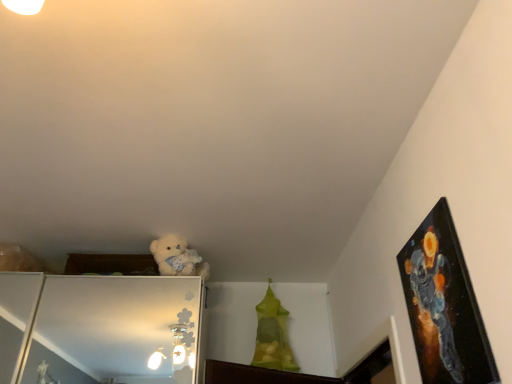
Describe the element at coordinates (444, 305) in the screenshot. Image resolution: width=512 pixels, height=384 pixels. I see `black glossy picture frame at upper right` at that location.

At what (x,y) coordinates should I click in order to perform the action: click on black glossy picture frame at upper right. Please return your answer as a coordinate pair (x, y). The width and height of the screenshot is (512, 384). Looking at the image, I should click on (444, 305).

In order to face black glossy picture frame at upper right, should I rotate leftwards or rightwards?

To face it directly, rotate right by 22.471 degrees.

What do you see at coordinates (178, 258) in the screenshot? This screenshot has height=384, width=512. I see `fluffy white teddy bear at upper center` at bounding box center [178, 258].

You are a GUI agent. You are given a task and a screenshot of the screen. Output one action in this format:
    pyautogui.click(x=<x>, y=<y>)
    Task: Click on the fluffy white teddy bear at upper center
    This screenshot has height=384, width=512.
    Given the screenshot: What is the action you would take?
    pyautogui.click(x=178, y=258)

The image size is (512, 384). In order to click on black glossy picture frame at upper right in this screenshot , I will do (444, 305).

Considering the relative positions of black glossy picture frame at upper right and fluffy white teddy bear at upper center in the image provided, is black glossy picture frame at upper right to the left of fluffy white teddy bear at upper center from the viewer's perspective?

Incorrect, black glossy picture frame at upper right is not on the left side of fluffy white teddy bear at upper center.

Which is behind, black glossy picture frame at upper right or fluffy white teddy bear at upper center?

fluffy white teddy bear at upper center is further away from the camera.

Considering the positions of points (426, 301) and (170, 249), is point (426, 301) closer to camera compared to point (170, 249)?

Yes, it is.

From the image's perspective, does black glossy picture frame at upper right appear higher than fluffy white teddy bear at upper center?

Yes, from the image's perspective, black glossy picture frame at upper right is on top of fluffy white teddy bear at upper center.

From a real-world perspective, which is physically above, black glossy picture frame at upper right or fluffy white teddy bear at upper center?

In real-world perspective, fluffy white teddy bear at upper center is above.

Can you confirm if black glossy picture frame at upper right is thinner than fluffy white teddy bear at upper center?

Correct, the width of black glossy picture frame at upper right is less than that of fluffy white teddy bear at upper center.

Does black glossy picture frame at upper right have a greater height compared to fluffy white teddy bear at upper center?

Yes, black glossy picture frame at upper right is taller than fluffy white teddy bear at upper center.

Based on the photo, considering the sizes of objects black glossy picture frame at upper right and fluffy white teddy bear at upper center in the image provided, who is smaller, black glossy picture frame at upper right or fluffy white teddy bear at upper center?

black glossy picture frame at upper right is smaller.

Is black glossy picture frame at upper right not within fluffy white teddy bear at upper center?

Yes, black glossy picture frame at upper right is outside of fluffy white teddy bear at upper center.

From the picture: Is black glossy picture frame at upper right not near fluffy white teddy bear at upper center?

black glossy picture frame at upper right is far away from fluffy white teddy bear at upper center.

Is black glossy picture frame at upper right facing away from fluffy white teddy bear at upper center?

No.

Looking at this image, what's the angular difference between black glossy picture frame at upper right and fluffy white teddy bear at upper center's facing directions?

There is a 79-degree angle between the facing directions of black glossy picture frame at upper right and fluffy white teddy bear at upper center.

How distant is black glossy picture frame at upper right from fluffy white teddy bear at upper center?

black glossy picture frame at upper right and fluffy white teddy bear at upper center are 3.80 feet apart.

You are a GUI agent. You are given a task and a screenshot of the screen. Output one action in this format:
    pyautogui.click(x=<x>, y=<y>)
    Task: Click on the picture frame below the fluffy white teddy bear at upper center (from a real-world perspective)
    The height and width of the screenshot is (384, 512).
    Given the screenshot: What is the action you would take?
    pyautogui.click(x=444, y=305)

From the picture: Which is more to the left, fluffy white teddy bear at upper center or black glossy picture frame at upper right?

From the viewer's perspective, fluffy white teddy bear at upper center appears more on the left side.

Considering the positions of objects fluffy white teddy bear at upper center and black glossy picture frame at upper right in the image provided, who is behind, fluffy white teddy bear at upper center or black glossy picture frame at upper right?

fluffy white teddy bear at upper center.

Does point (152, 250) come farther from viewer compared to point (408, 313)?

Yes, point (152, 250) is behind point (408, 313).

From the image's perspective, is fluffy white teddy bear at upper center on top of black glossy picture frame at upper right?

Incorrect, from the image's perspective, fluffy white teddy bear at upper center is lower than black glossy picture frame at upper right.

Looking at this image, from a real-world perspective, which is physically below, fluffy white teddy bear at upper center or black glossy picture frame at upper right?

black glossy picture frame at upper right is physically lower.

Based on the photo, between fluffy white teddy bear at upper center and black glossy picture frame at upper right, which one has larger width?

fluffy white teddy bear at upper center is wider.

Which of these two, fluffy white teddy bear at upper center or black glossy picture frame at upper right, stands shorter?

Standing shorter between the two is fluffy white teddy bear at upper center.

Between fluffy white teddy bear at upper center and black glossy picture frame at upper right, which one has smaller size?

With smaller size is black glossy picture frame at upper right.

Is fluffy white teddy bear at upper center spatially inside black glossy picture frame at upper right, or outside of it?

fluffy white teddy bear at upper center is not inside black glossy picture frame at upper right, it's outside.

Is fluffy white teddy bear at upper center not near black glossy picture frame at upper right?

Yes, fluffy white teddy bear at upper center and black glossy picture frame at upper right are located far from each other.

Is fluffy white teddy bear at upper center oriented towards black glossy picture frame at upper right?

No.

How different are the orientations of fluffy white teddy bear at upper center and black glossy picture frame at upper right in degrees?

There is a 79-degree angle between the facing directions of fluffy white teddy bear at upper center and black glossy picture frame at upper right.

How far apart are fluffy white teddy bear at upper center and black glossy picture frame at upper right?

fluffy white teddy bear at upper center and black glossy picture frame at upper right are 1.16 meters apart.

The width and height of the screenshot is (512, 384). Identify the location of animal that appears above the black glossy picture frame at upper right (from a real-world perspective). (178, 258).

This screenshot has height=384, width=512. I want to click on picture frame located underneath the fluffy white teddy bear at upper center (from a real-world perspective), so click(444, 305).

Where is `picture frame in front of the fluffy white teddy bear at upper center`? The image size is (512, 384). picture frame in front of the fluffy white teddy bear at upper center is located at coordinates (444, 305).